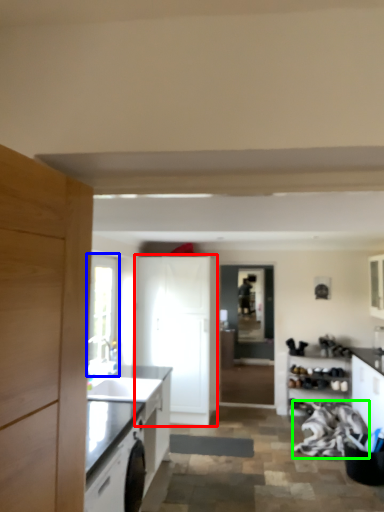
Question: Based on their relative distances, which object is nearer to cabinetry (highlighted by a red box)? Choose from window (highlighted by a blue box) and material (highlighted by a green box).

Choices:
 (A) window
 (B) material

Answer: (A)